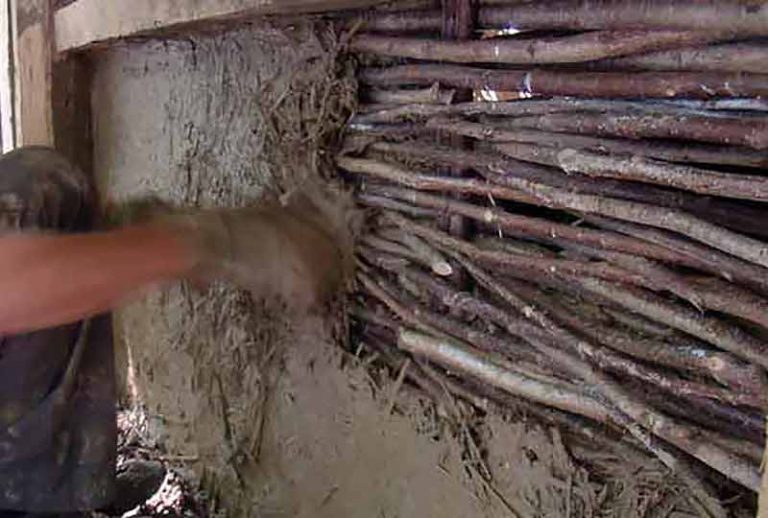
I want to click on sticks making up the internal structure of a wall, so click(505, 145).